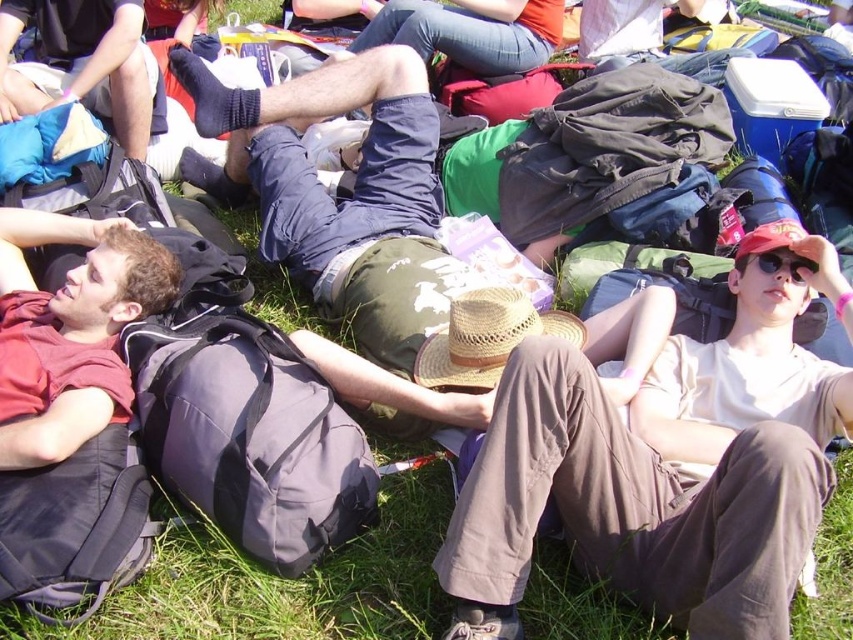
Question: Does matte black socks at upper left appear under matte black sunglasses at center right?

Choices:
 (A) yes
 (B) no

Answer: (B)

Question: Which is nearer to the matte black socks at upper left?

Choices:
 (A) matte black sunglasses at center right
 (B) matte red shirt at left

Answer: (B)

Question: Among these objects, which one is nearest to the camera?

Choices:
 (A) matte red shirt at left
 (B) matte black socks at upper left
 (C) khaki cotton pants at center

Answer: (C)

Question: Can you confirm if matte black socks at upper left is thinner than matte black sunglasses at center right?

Choices:
 (A) no
 (B) yes

Answer: (A)

Question: Can you confirm if matte red shirt at left is positioned to the left of matte black sunglasses at center right?

Choices:
 (A) no
 (B) yes

Answer: (B)

Question: Which is farther from the khaki cotton pants at center?

Choices:
 (A) matte black socks at upper left
 (B) matte black sunglasses at center right

Answer: (A)